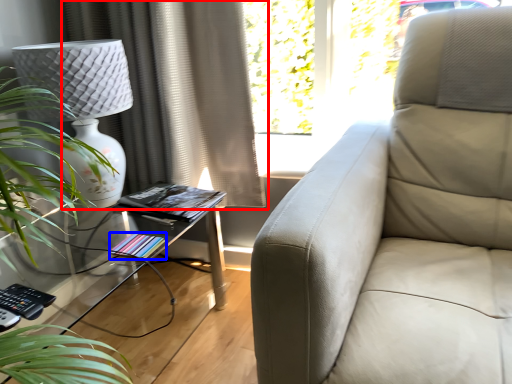
Question: Which point is closer to the camera, curtain (highlighted by a red box) or book (highlighted by a blue box)?

Choices:
 (A) curtain
 (B) book

Answer: (B)